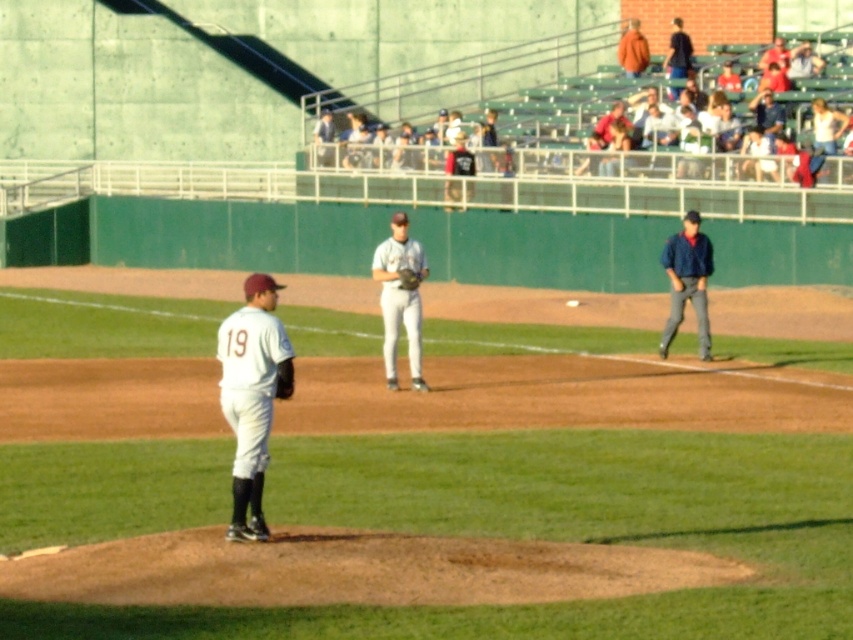
Who is lower down, white matte uniform at center or dark blue jacket at upper right?

white matte uniform at center is below.

Which is more to the right, white matte uniform at center or dark blue jacket at upper right?

From the viewer's perspective, dark blue jacket at upper right appears more on the right side.

At what (x,y) coordinates should I click in order to perform the action: click on white matte uniform at center. Please return your answer as a coordinate pair (x, y). Looking at the image, I should click on (250, 394).

You are a GUI agent. You are given a task and a screenshot of the screen. Output one action in this format:
    pyautogui.click(x=<x>, y=<y>)
    Task: Click on the white uniformed players at upper center
    Image resolution: width=853 pixels, height=640 pixels.
    Given the screenshot: What is the action you would take?
    pyautogui.click(x=517, y=88)

Between white matte uniform at center and matte gray uniform at center, which one is positioned lower?

white matte uniform at center is lower down.

Which of these two, white matte uniform at center or matte gray uniform at center, stands shorter?

With less height is white matte uniform at center.

This screenshot has height=640, width=853. I want to click on white matte uniform at center, so click(250, 394).